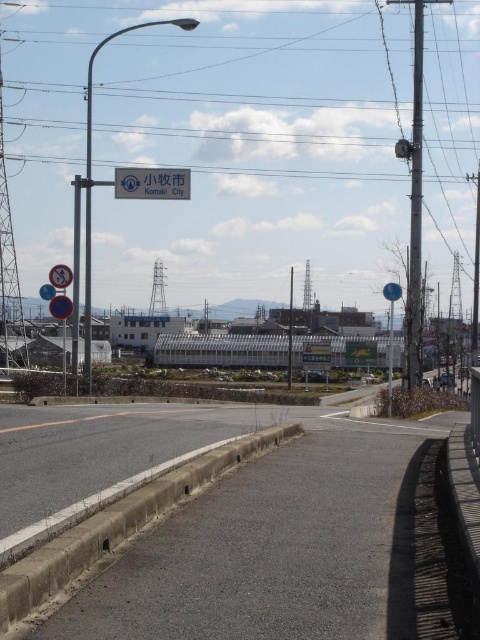
You are a tourist arriving at the entrance to Komaki City and see the white plastic sign at upper center and the blue plastic sign at upper center. Which sign is taller?

The white plastic sign at upper center is taller than the blue plastic sign at upper center according to the description.